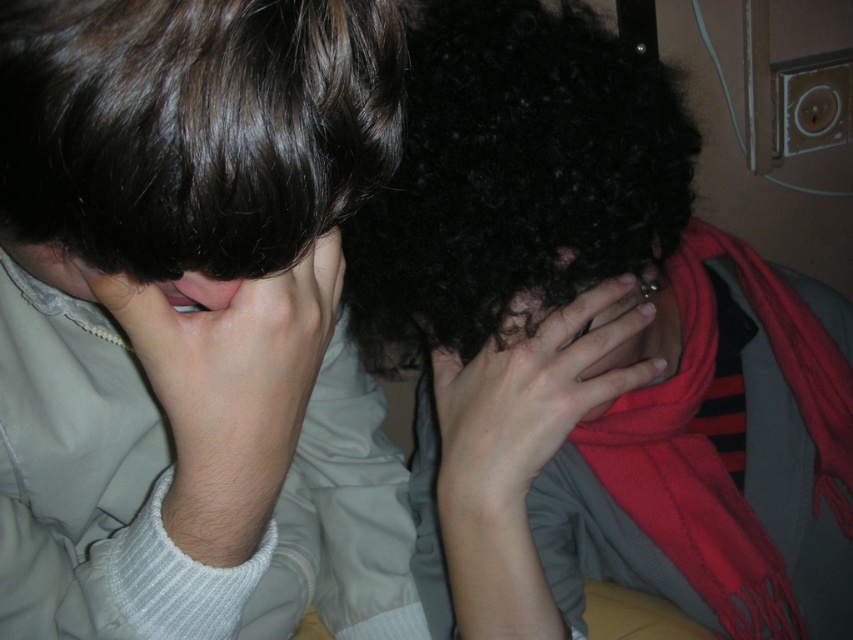
Is point (706, 433) more distant than point (502, 406)?

Yes.

Is point (573, 86) closer to camera compared to point (477, 416)?

Yes.

Which is in front, point (509, 509) or point (485, 486)?

Point (485, 486) is more forward.

Identify the location of curly hair at center. The image size is (853, 640). (596, 349).

Is curly hair at center positioned before light skin/hair at left?

No.

Is curly hair at center to the left of light skin/hair at left from the viewer's perspective?

Incorrect, curly hair at center is not on the left side of light skin/hair at left.

Which is in front, point (473, 256) or point (90, 276)?

Point (90, 276) is in front.

You are a GUI agent. You are given a task and a screenshot of the screen. Output one action in this format:
    pyautogui.click(x=<x>, y=<y>)
    Task: Click on the curly hair at center
    Image resolution: width=853 pixels, height=640 pixels.
    Given the screenshot: What is the action you would take?
    pyautogui.click(x=596, y=349)

Does smooth beige shirt at left have a smaller size compared to curly hair at center?

Yes, smooth beige shirt at left is smaller than curly hair at center.

At what (x,y) coordinates should I click in order to perform the action: click on smooth beige shirt at left. Please return your answer as a coordinate pair (x, y). Looking at the image, I should click on (192, 321).

Is point (111, 296) farther from camera compared to point (431, 497)?

No.

Locate an element on the screen. This screenshot has width=853, height=640. smooth beige shirt at left is located at coordinates (192, 321).